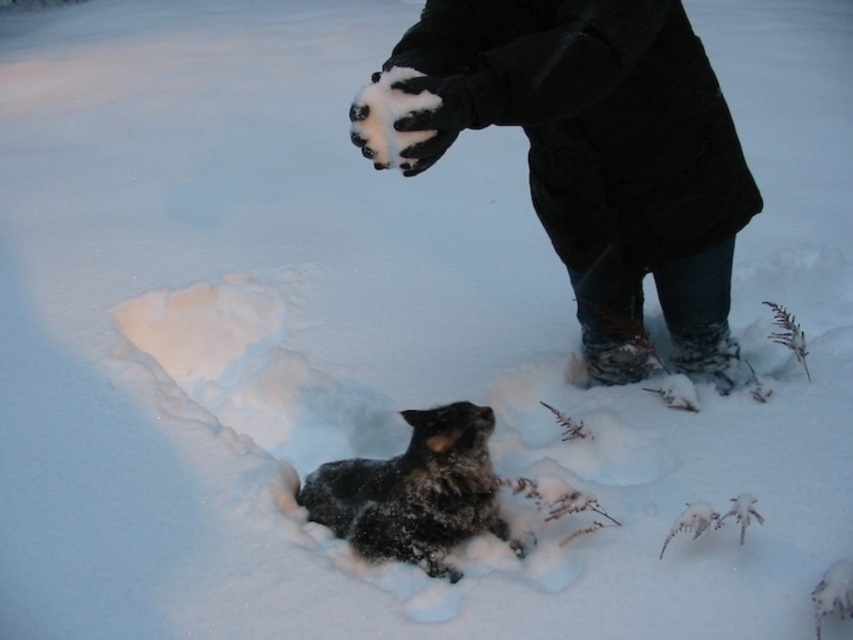
You are standing in the winter scene and want to throw a snowball. You have two points marked in the image. Which point is closer to you, point at coordinates [703,349] or point at coordinates [485,476]?

Point at coordinates [485,476] is closer to you because it is less further to the camera than point at coordinates [703,349].

You are standing in the snowy scene and want to pick up the black woolen coat at upper center and the fuzzy black dog at lower center. Which one can you reach without moving your feet?

The black woolen coat at upper center is closer to the viewer than the fuzzy black dog at lower center, so you can reach the black woolen coat at upper center without moving your feet.